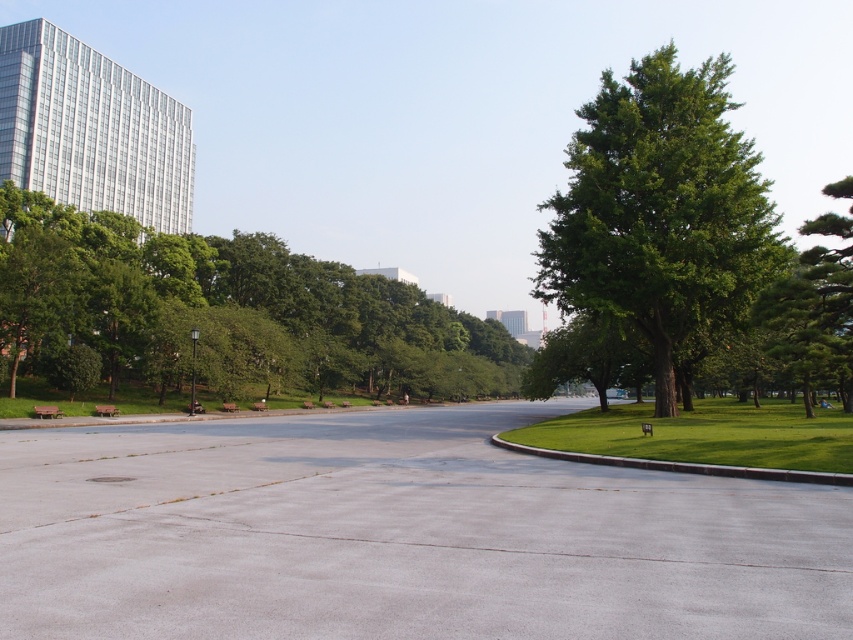
Question: Which of the following is the farthest from the observer?

Choices:
 (A) (422, 358)
 (B) (714, 320)

Answer: (A)

Question: Which point appears closest to the camera in this image?

Choices:
 (A) (753, 248)
 (B) (84, 268)

Answer: (A)

Question: Does green leafy tree at left have a larger size compared to green leafy tree at right?

Choices:
 (A) no
 (B) yes

Answer: (A)

Question: From the image, what is the correct spatial relationship of green leafy tree at left in relation to green leafy tree at right?

Choices:
 (A) below
 (B) above

Answer: (A)

Question: Can you confirm if green leafy tree at left is thinner than green leafy tree at right?

Choices:
 (A) yes
 (B) no

Answer: (A)

Question: Which of the following is the closest to the observer?

Choices:
 (A) green leafy tree at left
 (B) green leafy tree at right

Answer: (B)